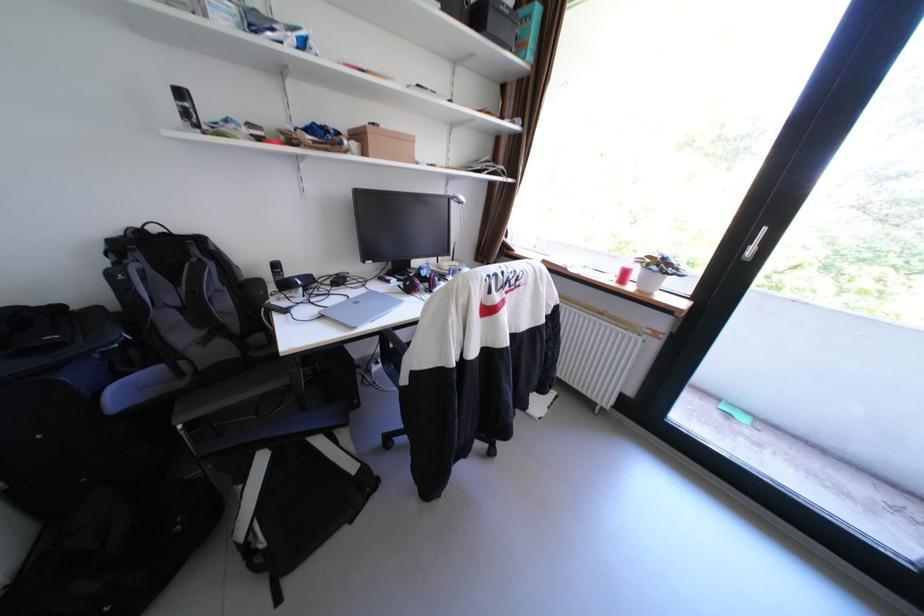
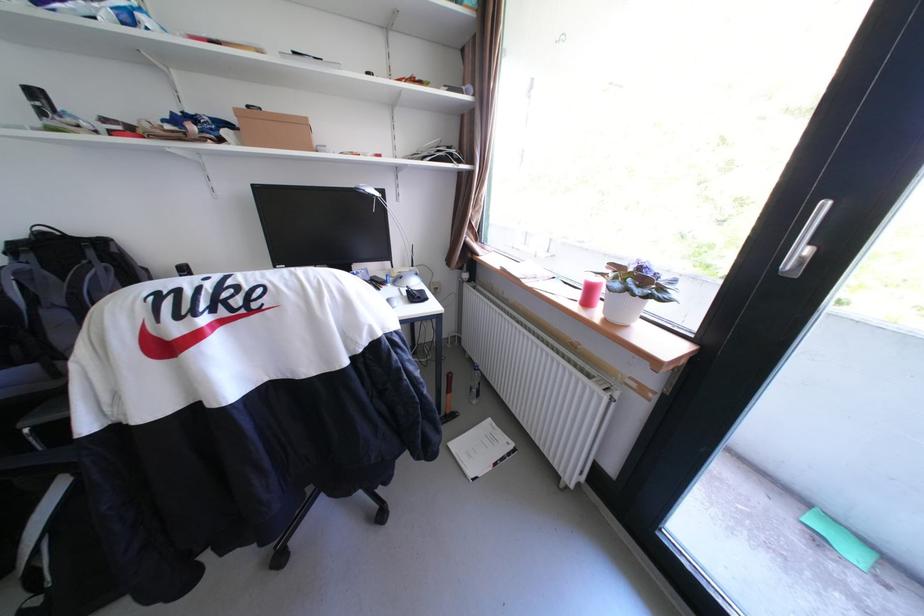
What movement of the cameraman would produce the second image?

The cameraman walked toward right, forward.